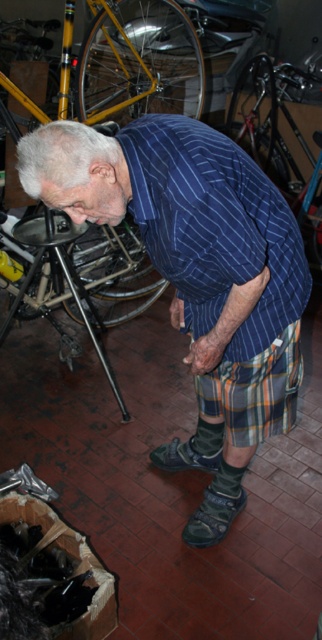
Question: Does shiny metallic bicycle at center appear over green suede shoe at lower center?

Choices:
 (A) yes
 (B) no

Answer: (A)

Question: Estimate the real-world distances between objects in this image. Which object is closer to the yellow matte bicycle at upper left?

Choices:
 (A) green fabric sandal at lower center
 (B) blue striped shirt at center
 (C) green suede shoe at lower center

Answer: (B)

Question: Where is black metal bicycle at lower left located in relation to green fabric sandal at lower center in the image?

Choices:
 (A) above
 (B) below

Answer: (A)

Question: Among these objects, which one is nearest to the camera?

Choices:
 (A) yellow matte bicycle at upper left
 (B) green suede shoe at lower center
 (C) green fabric sandal at lower center

Answer: (C)

Question: Does shiny metallic bicycle at center have a larger size compared to green suede shoe at lower center?

Choices:
 (A) yes
 (B) no

Answer: (A)

Question: Which point appears closest to the camera in this image?

Choices:
 (A) (218, 486)
 (B) (283, 81)
 (C) (43, 216)

Answer: (A)